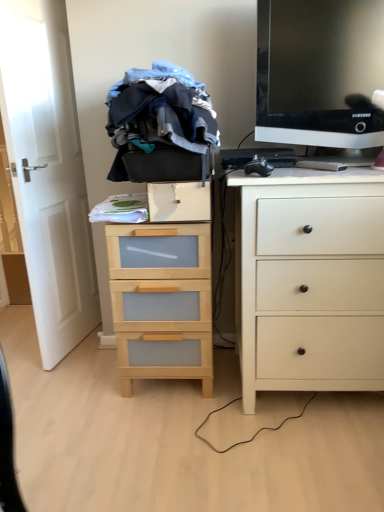
Image resolution: width=384 pixels, height=512 pixels. Find the location of `vacant area that is in front of white matte chest of drawers at right, which is counted as the 2th chest of drawers, starting from the left`. vacant area that is in front of white matte chest of drawers at right, which is counted as the 2th chest of drawers, starting from the left is located at coordinates (309, 457).